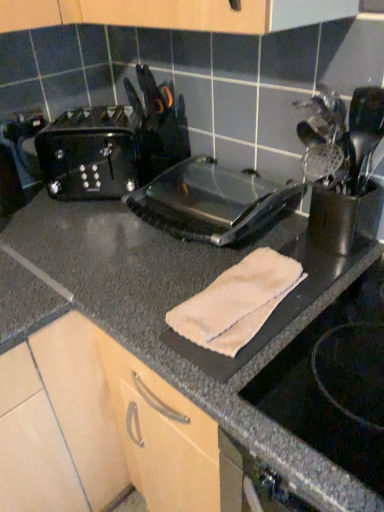
Where is `unoccupied area in front of transparent plastic toaster at center`? The width and height of the screenshot is (384, 512). unoccupied area in front of transparent plastic toaster at center is located at coordinates (195, 290).